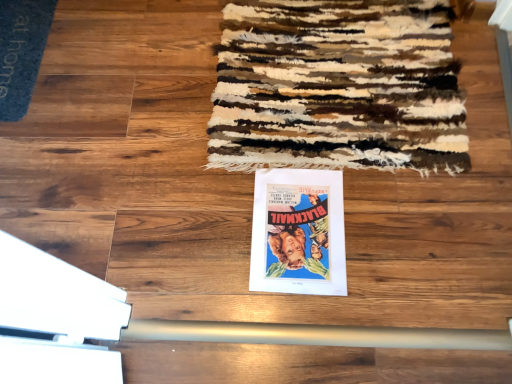
Where is `unoccupied region to the right of blue carpet at upper left`? This screenshot has width=512, height=384. unoccupied region to the right of blue carpet at upper left is located at coordinates (99, 53).